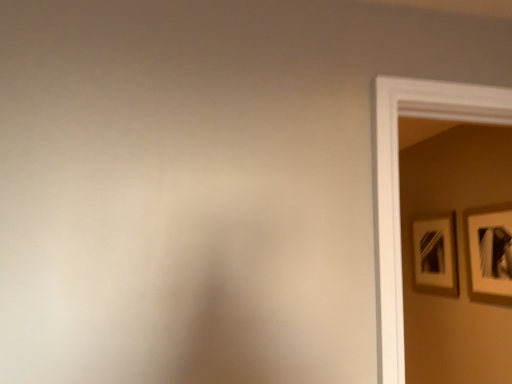
Question: Would you say white matte picture frame at upper right, placed as the 1th picture frame when sorted from left to right, is to the left or to the right of matte white picture frame at right, arranged as the 1th picture frame when viewed from the right, in the picture?

Choices:
 (A) right
 (B) left

Answer: (B)

Question: Choose the correct answer: Is white matte picture frame at upper right, acting as the first picture frame starting from the back, inside matte white picture frame at right, which appears as the second picture frame when viewed from the back, or outside it?

Choices:
 (A) outside
 (B) inside

Answer: (A)

Question: From their relative heights in the image, would you say white matte picture frame at upper right, placed as the 1th picture frame when sorted from left to right, is taller or shorter than matte white picture frame at right, which ranks as the second picture frame in left-to-right order?

Choices:
 (A) tall
 (B) short

Answer: (B)

Question: Considering the positions of matte white picture frame at right, which ranks as the second picture frame in left-to-right order, and white matte picture frame at upper right, placed as the 1th picture frame when sorted from left to right, in the image, is matte white picture frame at right, which ranks as the second picture frame in left-to-right order, taller or shorter than white matte picture frame at upper right, placed as the 1th picture frame when sorted from left to right,?

Choices:
 (A) short
 (B) tall

Answer: (B)

Question: From the image's perspective, is matte white picture frame at right, the 1th picture frame positioned from the front, above or below white matte picture frame at upper right, placed as the 1th picture frame when sorted from left to right?

Choices:
 (A) above
 (B) below

Answer: (A)

Question: Looking at the image, does matte white picture frame at right, which ranks as the second picture frame in left-to-right order, seem bigger or smaller compared to white matte picture frame at upper right, acting as the first picture frame starting from the back?

Choices:
 (A) big
 (B) small

Answer: (B)

Question: Which is correct: matte white picture frame at right, the 1th picture frame positioned from the front, is inside white matte picture frame at upper right, the second picture frame when ordered from right to left, or outside of it?

Choices:
 (A) outside
 (B) inside

Answer: (A)